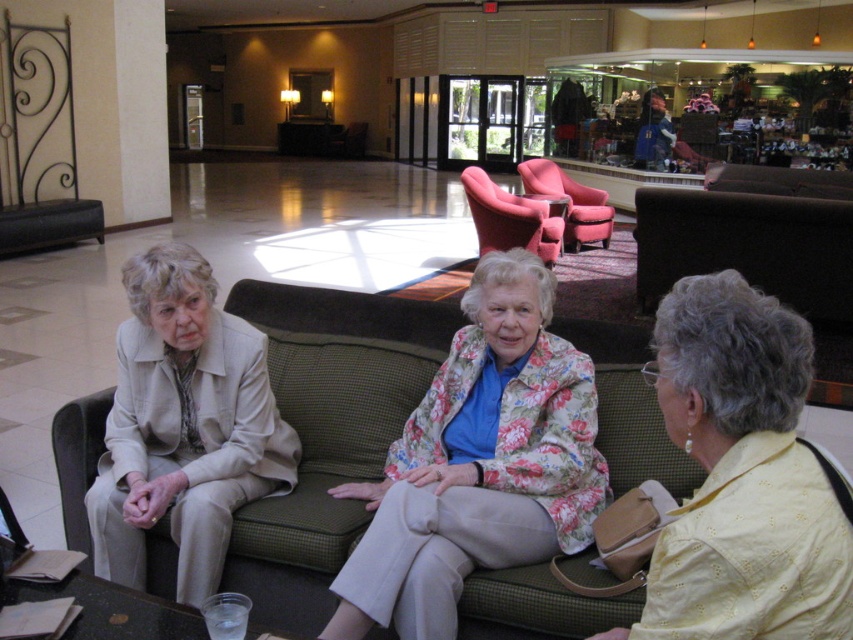
Question: Can you confirm if green fabric couch at center is bigger than yellow dotted shirt at lower right?

Choices:
 (A) no
 (B) yes

Answer: (B)

Question: Which point is farther from the camera taking this photo?

Choices:
 (A) (183, 486)
 (B) (729, 371)
 (C) (368, 314)
 (D) (582, 243)

Answer: (D)

Question: Which object is positioned closest to the yellow dotted shirt at lower right?

Choices:
 (A) green fabric couch at center
 (B) velvet-like pink armchair at center

Answer: (A)

Question: Among these points, which one is farthest from the camera?

Choices:
 (A) (x=132, y=545)
 (B) (x=509, y=272)
 (C) (x=495, y=236)

Answer: (C)

Question: Is yellow dotted shirt at lower right thinner than beige fabric jacket at left?

Choices:
 (A) yes
 (B) no

Answer: (A)

Question: Where is green fabric couch at center located in relation to velvet-like pink armchair at center in the image?

Choices:
 (A) above
 (B) below

Answer: (B)